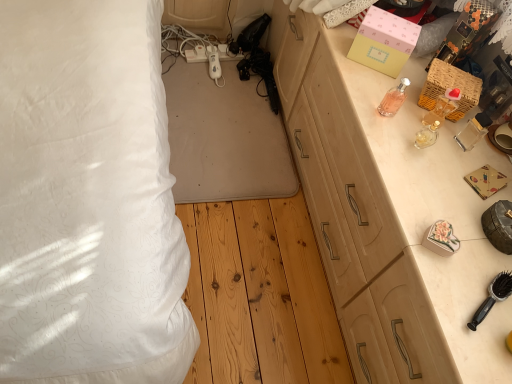
Locate an element on the screen. This screenshot has width=512, height=384. free location to the left of translucent glass perfume at right, the 2th perfume viewed from the right is located at coordinates (372, 122).